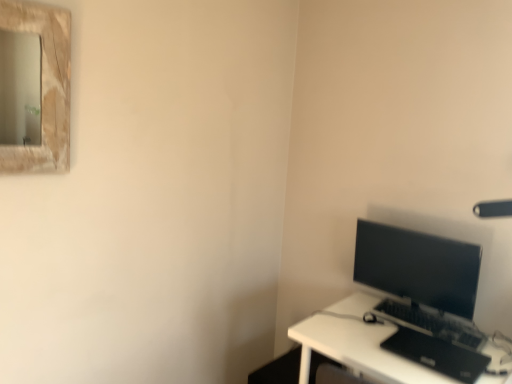
Question: Is black matte laptop at lower right positioned behind matte black monitor at right?

Choices:
 (A) no
 (B) yes

Answer: (A)

Question: From a real-world perspective, is black matte laptop at lower right over matte black monitor at right?

Choices:
 (A) yes
 (B) no

Answer: (B)

Question: Is black matte laptop at lower right thinner than matte black monitor at right?

Choices:
 (A) yes
 (B) no

Answer: (B)

Question: Is black matte laptop at lower right not within matte black monitor at right?

Choices:
 (A) yes
 (B) no

Answer: (A)

Question: Does black matte laptop at lower right appear on the left side of matte black monitor at right?

Choices:
 (A) yes
 (B) no

Answer: (B)

Question: Relative to black matte laptop at lower right, is white plastic desk at lower right in front or behind?

Choices:
 (A) front
 (B) behind

Answer: (A)

Question: From a real-world perspective, is white plastic desk at lower right positioned above or below black matte laptop at lower right?

Choices:
 (A) below
 (B) above

Answer: (A)

Question: Is white plastic desk at lower right to the left or to the right of black matte laptop at lower right in the image?

Choices:
 (A) left
 (B) right

Answer: (A)

Question: From the image's perspective, is white plastic desk at lower right positioned above or below black matte laptop at lower right?

Choices:
 (A) below
 (B) above

Answer: (A)

Question: Considering their positions, is matte black monitor at right located in front of or behind black plastic keyboard at lower right?

Choices:
 (A) behind
 (B) front

Answer: (A)

Question: From a real-world perspective, is matte black monitor at right above or below black plastic keyboard at lower right?

Choices:
 (A) below
 (B) above

Answer: (B)

Question: In the image, is matte black monitor at right on the left side or the right side of black plastic keyboard at lower right?

Choices:
 (A) left
 (B) right

Answer: (A)

Question: Considering the positions of point (470, 253) and point (474, 332), is point (470, 253) closer or farther from the camera than point (474, 332)?

Choices:
 (A) farther
 (B) closer

Answer: (B)

Question: Is black matte laptop at lower right spatially inside black plastic keyboard at lower right, or outside of it?

Choices:
 (A) inside
 (B) outside

Answer: (B)

Question: Considering their positions, is black matte laptop at lower right located in front of or behind black plastic keyboard at lower right?

Choices:
 (A) front
 (B) behind

Answer: (A)